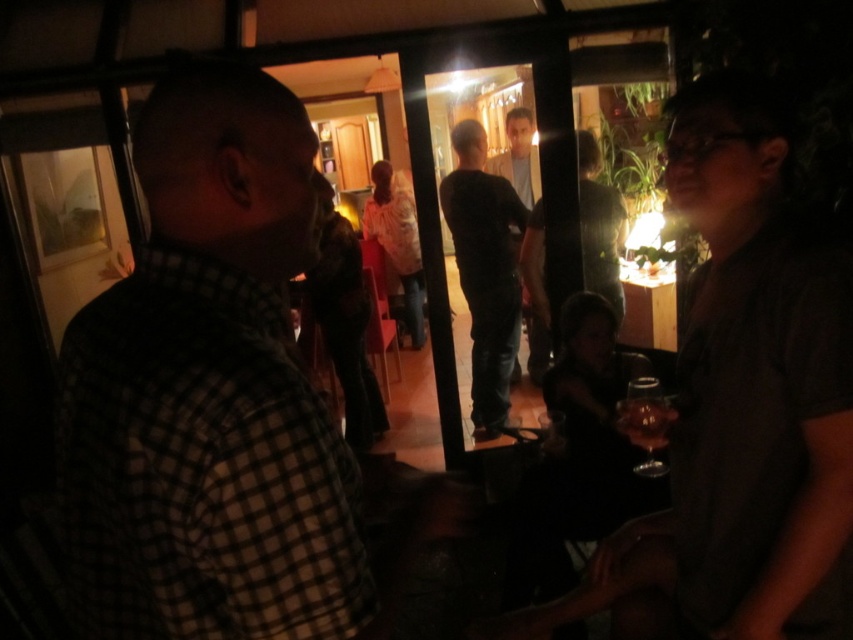
Question: Does dark gray shirt at center have a lesser width compared to dark brown leather jacket at center?

Choices:
 (A) no
 (B) yes

Answer: (A)

Question: Which object is farther from the camera taking this photo?

Choices:
 (A) dark brown leather jacket at center
 (B) dark gray shirt at center
 (C) dark gray shirt at right

Answer: (A)

Question: Which object is closer to the camera taking this photo?

Choices:
 (A) dark gray shirt at center
 (B) dark gray shirt at right
 (C) dark gray jeans at center
 (D) white textured sweater at center

Answer: (B)

Question: Which point is farther to the camera?

Choices:
 (A) dark brown leather jacket at center
 (B) dark gray shirt at right

Answer: (A)

Question: Considering the relative positions of checkered fabric shirt at left and dark gray shirt at center in the image provided, where is checkered fabric shirt at left located with respect to dark gray shirt at center?

Choices:
 (A) above
 (B) below

Answer: (B)

Question: Is dark gray shirt at right above dark gray jeans at center?

Choices:
 (A) no
 (B) yes

Answer: (A)